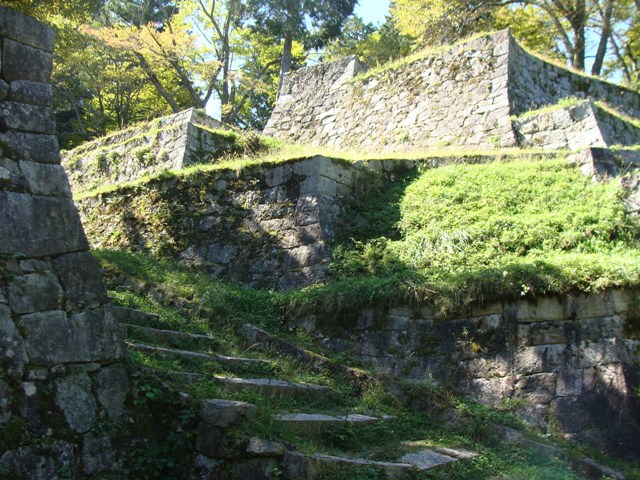
Identify the location of wall to the left of stairs. (45, 280).